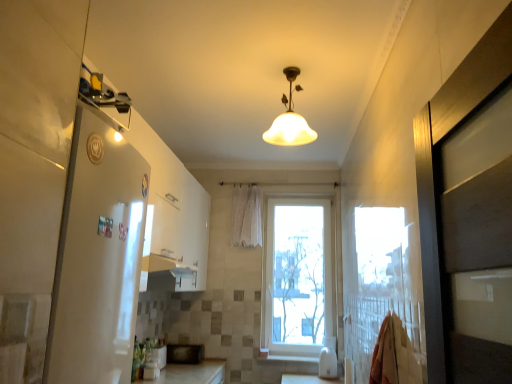
Question: Is matte glass lampshade at center far away from white sheer curtain at center?

Choices:
 (A) no
 (B) yes

Answer: (B)

Question: Is matte glass lampshade at center to the left of white sheer curtain at center from the viewer's perspective?

Choices:
 (A) yes
 (B) no

Answer: (B)

Question: Is matte glass lampshade at center looking in the opposite direction of white sheer curtain at center?

Choices:
 (A) yes
 (B) no

Answer: (B)

Question: Can we say matte glass lampshade at center lies outside white sheer curtain at center?

Choices:
 (A) no
 (B) yes

Answer: (B)

Question: Considering the relative sizes of matte glass lampshade at center and white sheer curtain at center in the image provided, is matte glass lampshade at center taller than white sheer curtain at center?

Choices:
 (A) no
 (B) yes

Answer: (A)

Question: Is point (272, 256) positioned closer to the camera than point (306, 139)?

Choices:
 (A) farther
 (B) closer

Answer: (A)

Question: From a real-world perspective, is white plastic window at center physically located above or below matte glass lampshade at center?

Choices:
 (A) above
 (B) below

Answer: (B)

Question: Visually, is white plastic window at center positioned to the left or to the right of matte glass lampshade at center?

Choices:
 (A) right
 (B) left

Answer: (A)

Question: In terms of height, does white plastic window at center look taller or shorter compared to matte glass lampshade at center?

Choices:
 (A) tall
 (B) short

Answer: (A)

Question: Is white glossy wood at lower center inside the boundaries of white sheer curtain at center, or outside?

Choices:
 (A) inside
 (B) outside

Answer: (B)

Question: From the image's perspective, is white glossy wood at lower center positioned above or below white sheer curtain at center?

Choices:
 (A) below
 (B) above

Answer: (A)

Question: Would you say white glossy wood at lower center is to the left or to the right of white sheer curtain at center in the picture?

Choices:
 (A) right
 (B) left

Answer: (A)

Question: Is white glossy wood at lower center in front of or behind white sheer curtain at center in the image?

Choices:
 (A) behind
 (B) front

Answer: (B)

Question: Is point (314, 137) closer or farther from the camera than point (67, 248)?

Choices:
 (A) closer
 (B) farther

Answer: (B)

Question: From a real-world perspective, is matte glass lampshade at center above or below white glossy refrigerator at left?

Choices:
 (A) above
 (B) below

Answer: (A)